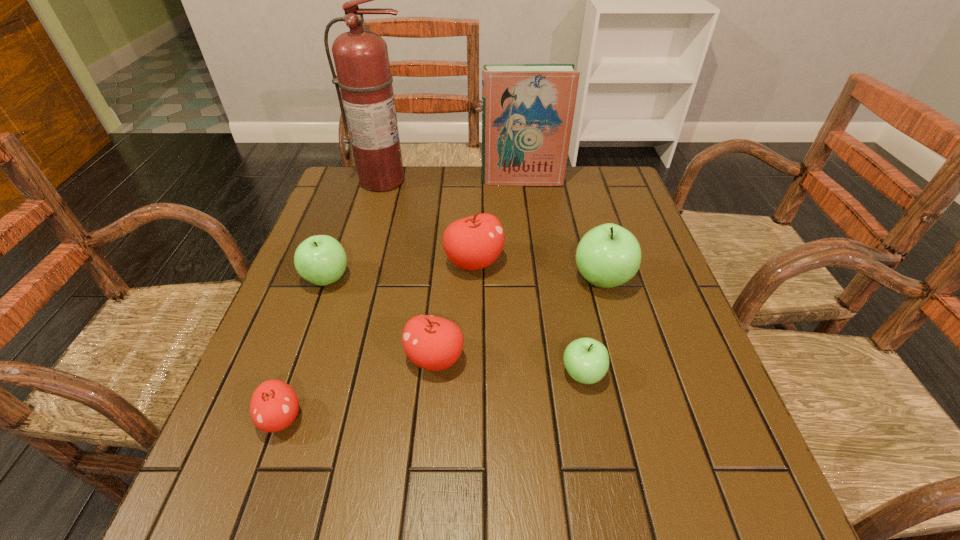
Locate an element on the screen. The image size is (960, 540). object that is the seventh closest one to the biggest red apple is located at coordinates coord(274,406).

This screenshot has width=960, height=540. Identify the location of the fourth closest apple to the tallest object. (433, 343).

This screenshot has height=540, width=960. Find the location of `apple that is the closest to the farthest red apple`. apple that is the closest to the farthest red apple is located at coordinates (607, 256).

You are a GUI agent. You are given a task and a screenshot of the screen. Output one action in this format:
    pyautogui.click(x=<x>, y=<y>)
    Task: Click on the third closest green apple relative to the hardback book
    The image size is (960, 540).
    Given the screenshot: What is the action you would take?
    pyautogui.click(x=586, y=360)

Locate an element on the screen. green apple that can be found as the closest to the second tallest object is located at coordinates (607, 256).

Identify which red apple is located as the second nearest to the second nearest red apple. Please provide its 2D coordinates. Your answer should be formatted as a tuple, i.e. [(x, y)], where the tuple contains the x and y coordinates of a point satisfying the conditions above.

[(274, 406)]

The image size is (960, 540). I want to click on red apple that can be found as the closest to the fire extinguisher, so click(472, 243).

At what (x,y) coordinates should I click in order to perform the action: click on free region that satisfies the following two spatial constraints: 1. on the cover of the nearest green apple; 2. on the right side of the hardback book. Please return your answer as a coordinate pair (x, y). Image resolution: width=960 pixels, height=540 pixels. Looking at the image, I should click on (546, 374).

Identify the location of free space that satisfies the following two spatial constraints: 1. on the front-facing side of the fire extinguisher; 2. on the left side of the biggest green apple. (354, 280).

The image size is (960, 540). In order to click on vacant point that satisfies the following two spatial constraints: 1. on the cover of the hardback book; 2. on the right side of the biggest green apple in this screenshot , I will do `click(535, 280)`.